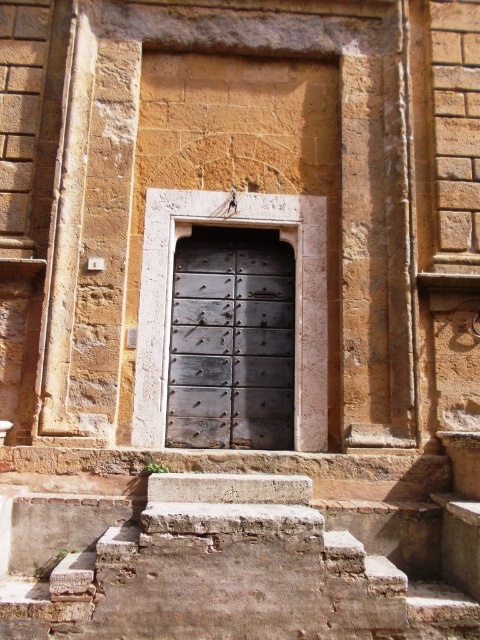
You are standing in front of the old stone building and want to enter through the rusty metal door at center. To reach the door, you need to navigate the rusty stone stairs at lower center. Are the stairs located below the door?

Yes, the rusty stone stairs at lower center are located below the rusty metal door at center, so you can climb them to reach the door.

You are standing in front of the old stone building and want to find the entrance. Based on the image, where is the rusty stone stairs at lower center located relative to the weathered wooden door?

The rusty stone stairs at lower center are positioned at coordinates point (217, 570), which places them below the weathered wooden door, making them the likely entrance point.